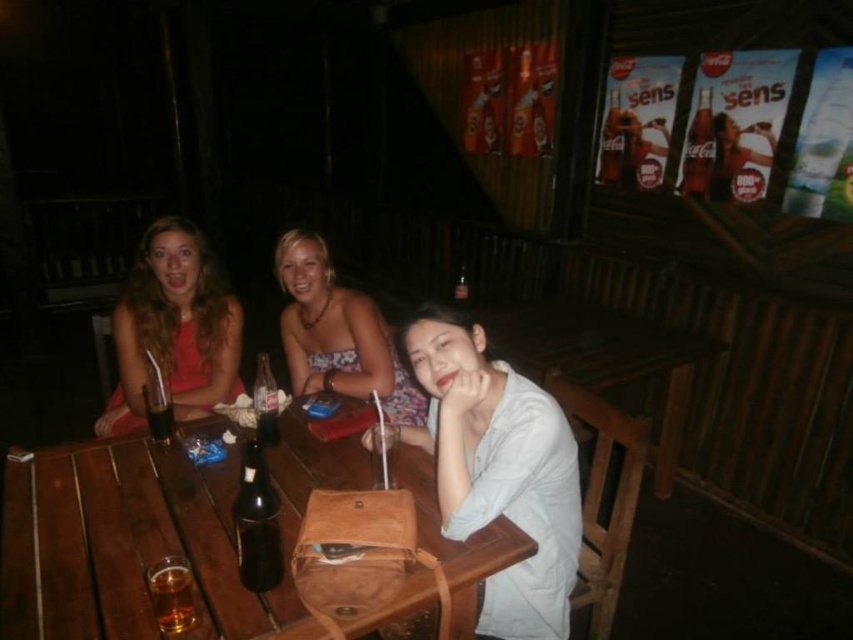
Question: Considering the real-world distances, which object is farthest from the floral fabric dress at center?

Choices:
 (A) matte brown bag at center
 (B) dark glass bottle at table center
 (C) wooden table at center

Answer: (B)

Question: Which point appears farthest from the camera in this image?

Choices:
 (A) (579, 524)
 (B) (213, 509)

Answer: (A)

Question: Does black glass bottle at center come in front of translucent glass beer at table center?

Choices:
 (A) no
 (B) yes

Answer: (A)

Question: Does floral fabric dress at center appear on the right side of dark glass bottle at table center?

Choices:
 (A) yes
 (B) no

Answer: (A)

Question: Does floral fabric dress at center have a smaller size compared to dark glass bottle at table center?

Choices:
 (A) yes
 (B) no

Answer: (B)

Question: Which of the following is the closest to the observer?

Choices:
 (A) (177, 301)
 (B) (381, 369)
 (C) (514, 480)
 (D) (247, 570)

Answer: (D)